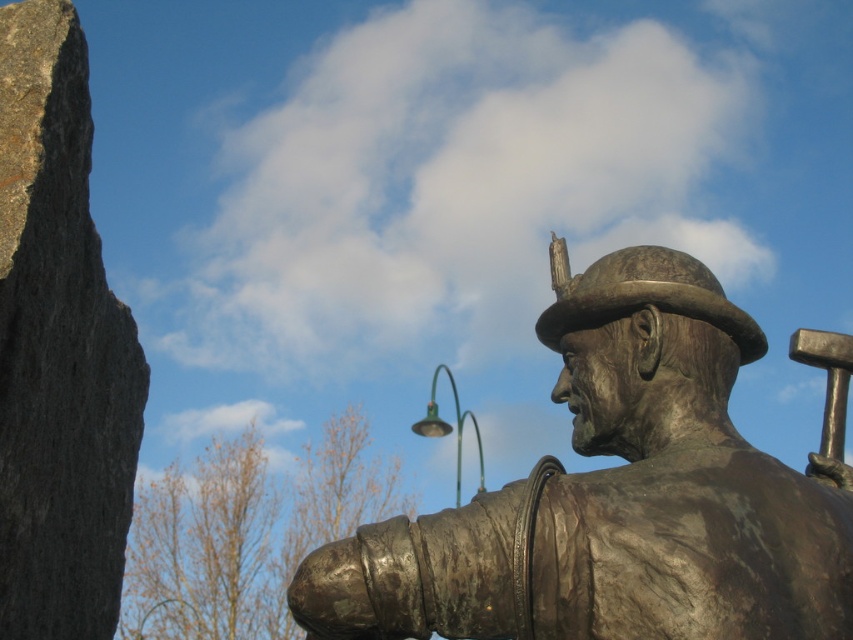
Is bronze statue at center smaller than green metallic lamp post at upper center?

Indeed, bronze statue at center has a smaller size compared to green metallic lamp post at upper center.

From the picture: Is bronze statue at center to the right of green metallic lamp post at upper center from the viewer's perspective?

Indeed, bronze statue at center is positioned on the right side of green metallic lamp post at upper center.

Find the location of `bronze statue at center`. bronze statue at center is located at coordinates (614, 497).

Is bronze statue at center shorter than gray rough stone at left?

Yes, bronze statue at center is shorter than gray rough stone at left.

Is point (651, 260) positioned after point (99, 396)?

No, (651, 260) is closer to viewer.

At what (x,y) coordinates should I click in order to perform the action: click on bronze statue at center. Please return your answer as a coordinate pair (x, y). Image resolution: width=853 pixels, height=640 pixels. Looking at the image, I should click on (614, 497).

What do you see at coordinates (57, 348) in the screenshot? I see `gray rough stone at left` at bounding box center [57, 348].

Does gray rough stone at left have a larger size compared to green metallic lamp post at upper center?

Actually, gray rough stone at left might be smaller than green metallic lamp post at upper center.

The height and width of the screenshot is (640, 853). I want to click on gray rough stone at left, so click(57, 348).

You are a GUI agent. You are given a task and a screenshot of the screen. Output one action in this format:
    pyautogui.click(x=<x>, y=<y>)
    Task: Click on the gray rough stone at left
    The image size is (853, 640).
    Given the screenshot: What is the action you would take?
    pyautogui.click(x=57, y=348)